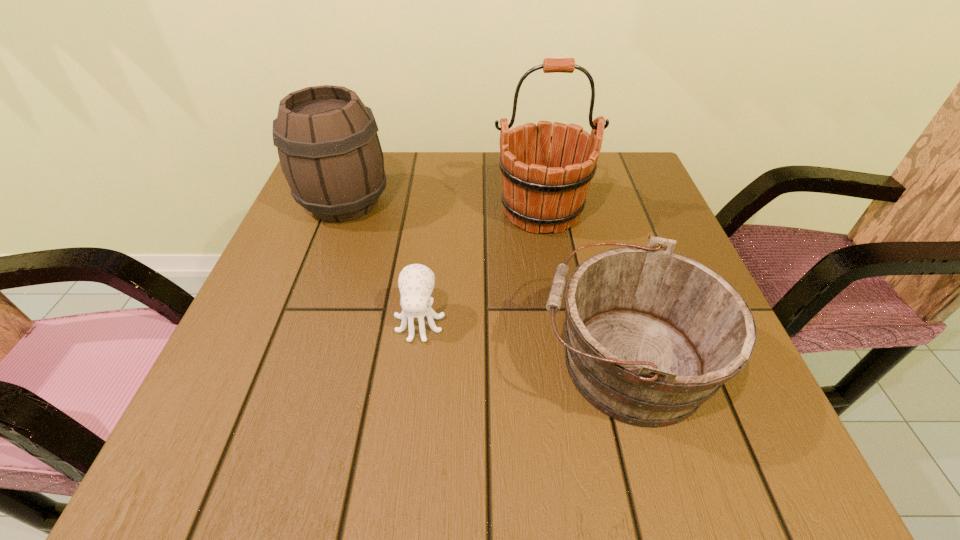
At what (x,y) coordinates should I click in order to perform the action: click on free space at the near right corner of the desktop. Please return your answer as a coordinate pair (x, y). Image resolution: width=960 pixels, height=540 pixels. Looking at the image, I should click on (767, 446).

Where is `blank region between the shortest wine bucket and the third object from right to left`? This screenshot has width=960, height=540. blank region between the shortest wine bucket and the third object from right to left is located at coordinates (522, 341).

Find the location of a particular element. This screenshot has height=540, width=960. empty space between the shortest object and the second tallest object is located at coordinates tap(382, 262).

I want to click on vacant area that lies between the tallest object and the leftmost wine bucket, so click(444, 207).

Identify the location of free space between the leftmost wine bucket and the nearest wine bucket. The width and height of the screenshot is (960, 540). (485, 282).

Where is `free area in between the nearest wine bucket and the third object from right to left`? free area in between the nearest wine bucket and the third object from right to left is located at coordinates (522, 341).

Identify the location of vacant space that's between the shortest object and the leftmost wine bucket. (382, 262).

Image resolution: width=960 pixels, height=540 pixels. What are the coordinates of `free space that is in between the second tallest object and the third tallest object` in the screenshot? It's located at (485, 282).

Find the location of a particular element. free space between the second shortest object and the leftmost object is located at coordinates pyautogui.click(x=485, y=282).

At what (x,y) coordinates should I click in order to perform the action: click on object that is the closest one to the tallest object. Please return your answer as a coordinate pair (x, y). The width and height of the screenshot is (960, 540). Looking at the image, I should click on (651, 335).